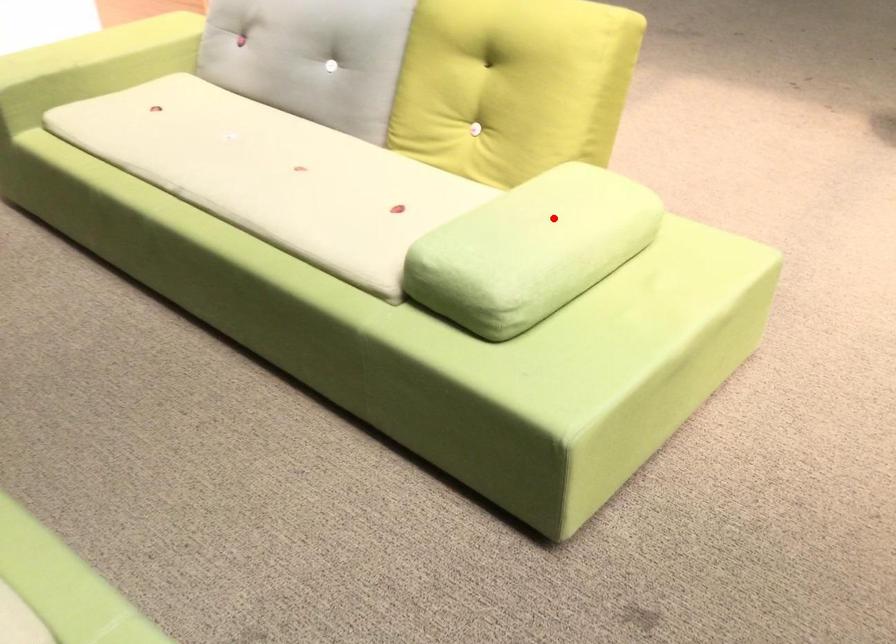
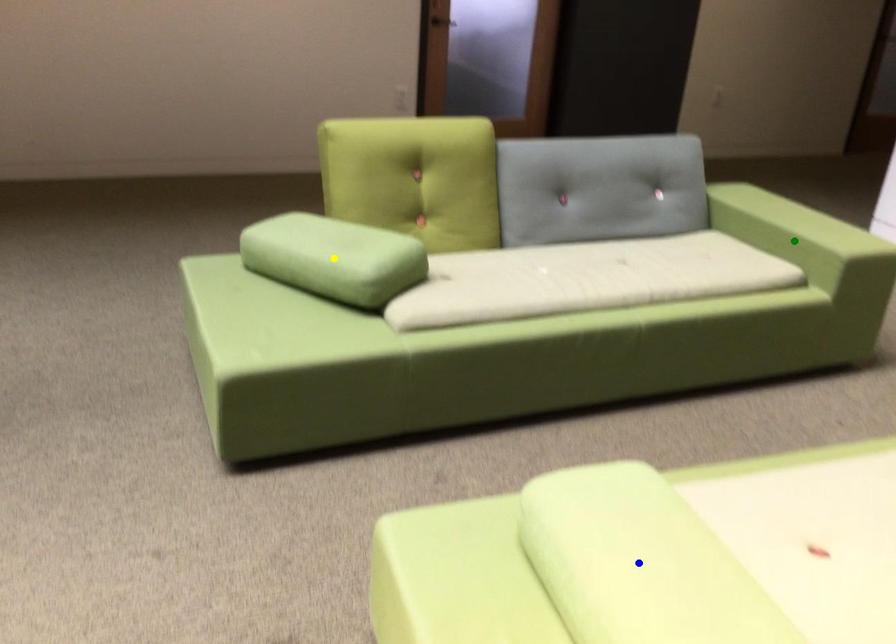
Question: I am providing you with two images of the same scene from different viewpoints. A red point is marked on the first image. You are given multiple points on the second image. Which point in image 2 is actually the same real-world point as the red point in image 1?

Choices:
 (A) blue point
 (B) green point
 (C) yellow point

Answer: (A)